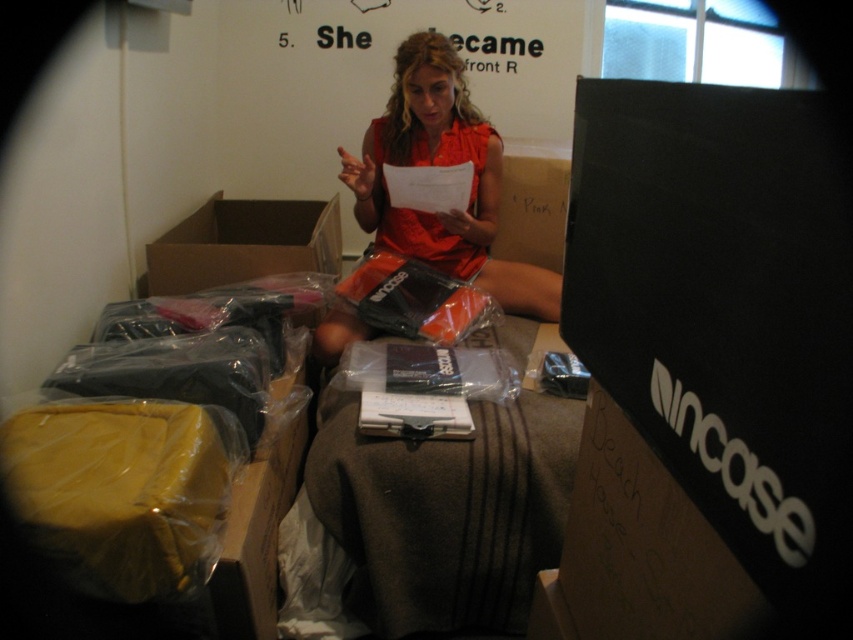
Can you confirm if orange matte dress at center is positioned above brown cardboard box at upper left?

Indeed, orange matte dress at center is positioned over brown cardboard box at upper left.

Is point (442, 230) closer to viewer compared to point (164, 294)?

No, (442, 230) is behind (164, 294).

Identify the location of orange matte dress at center. (442, 164).